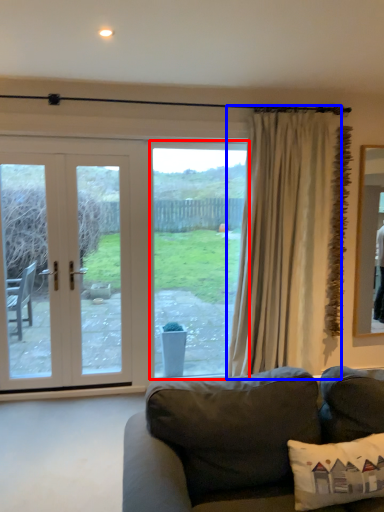
Question: Which point is further to the camera, window (highlighted by a red box) or curtain (highlighted by a blue box)?

Choices:
 (A) window
 (B) curtain

Answer: (A)